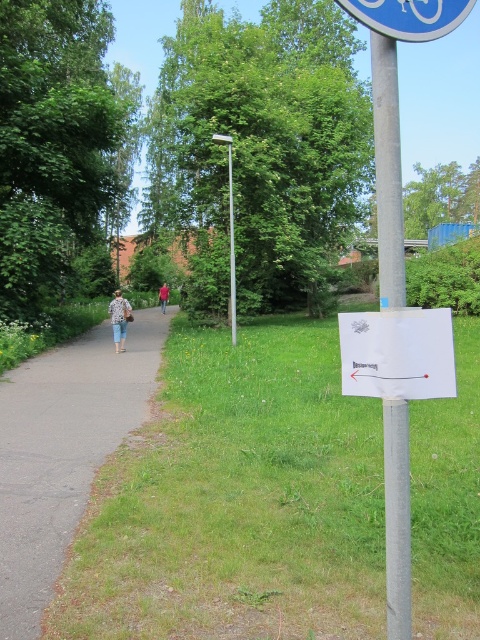
From the picture: You are standing at the point marked as point (62,451). Which surface are you currently standing on?

You are standing on dark gray asphalt at left.

You are a hiker who wants to read the directions on the blue plastic sign at upper center and the white paper sign at center. Which sign will you need to step closer to in order to read its text?

The blue plastic sign at upper center is behind the white paper sign at center, so you will need to step closer to the blue plastic sign at upper center to read its text because it is farther away.

In the scene shown: You are a hiker who wants to place a small flag on the dark gray asphalt at left and the white paper sign at center. Which surface will the flag be more visible from above?

The flag placed on the white paper sign at center will be more visible from above because it is higher than the dark gray asphalt at left.